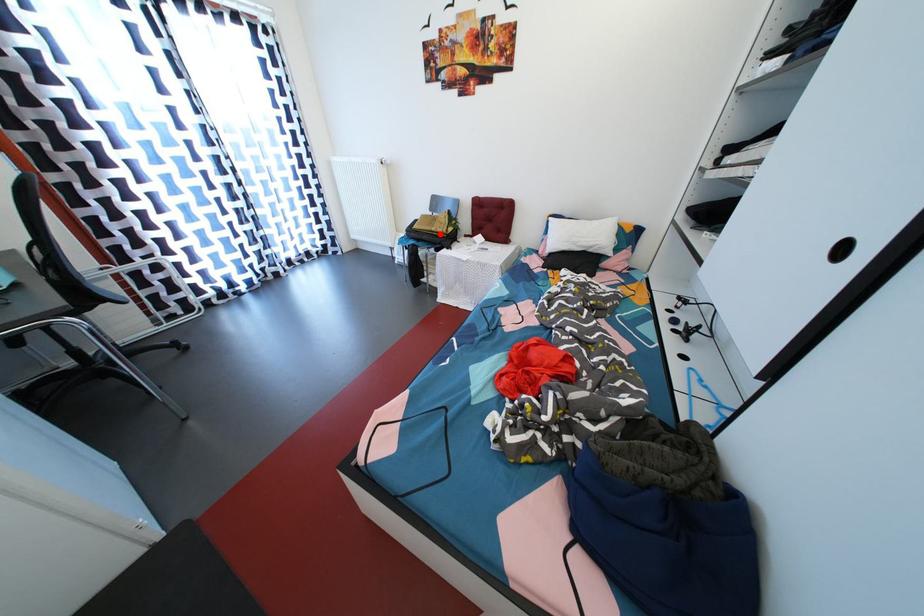
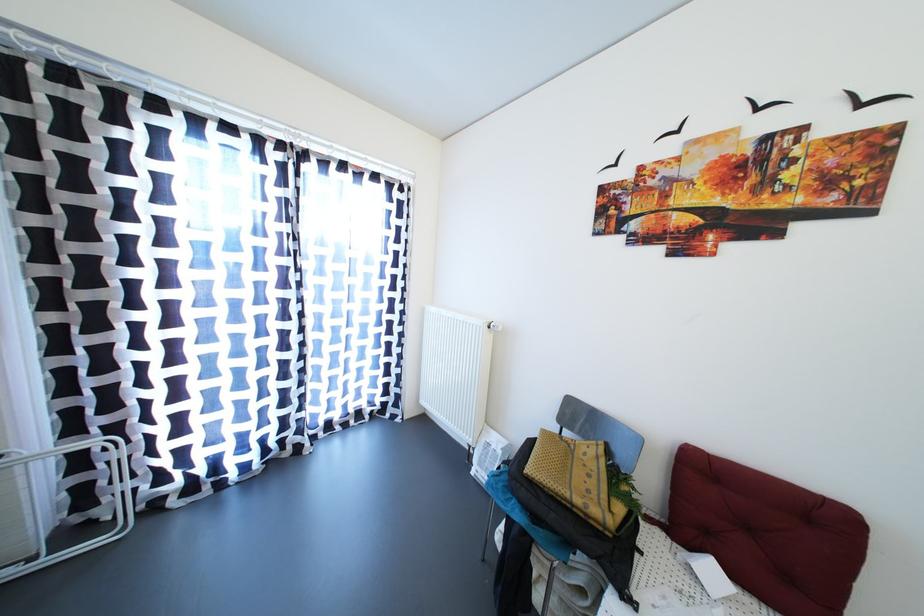
Question: I am providing you with two images of the same scene from different viewpoints. Given a red point in image1, look at the same physical point in image2. Is it:

Choices:
 (A) Closer to the viewpoint
 (B) Farther from the viewpoint

Answer: (B)